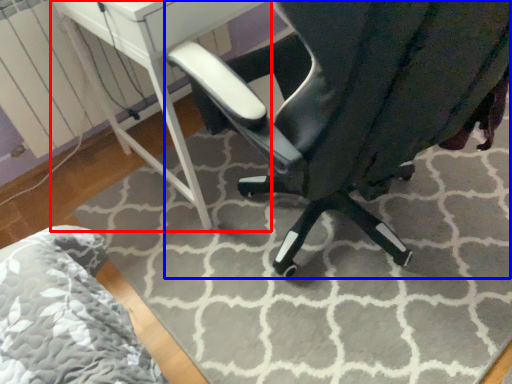
Question: Among these objects, which one is farthest to the camera, table (highlighted by a red box) or chair (highlighted by a blue box)?

Choices:
 (A) table
 (B) chair

Answer: (A)